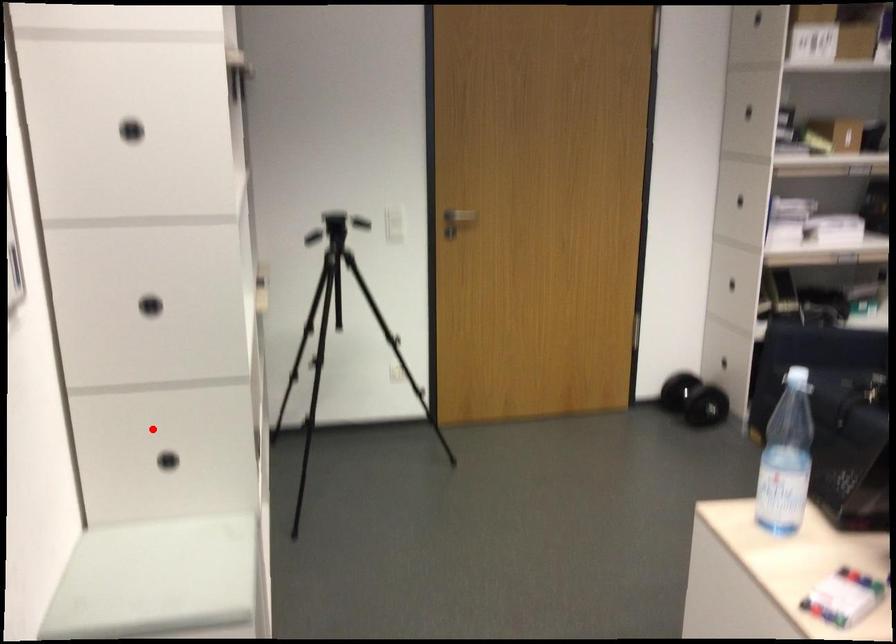
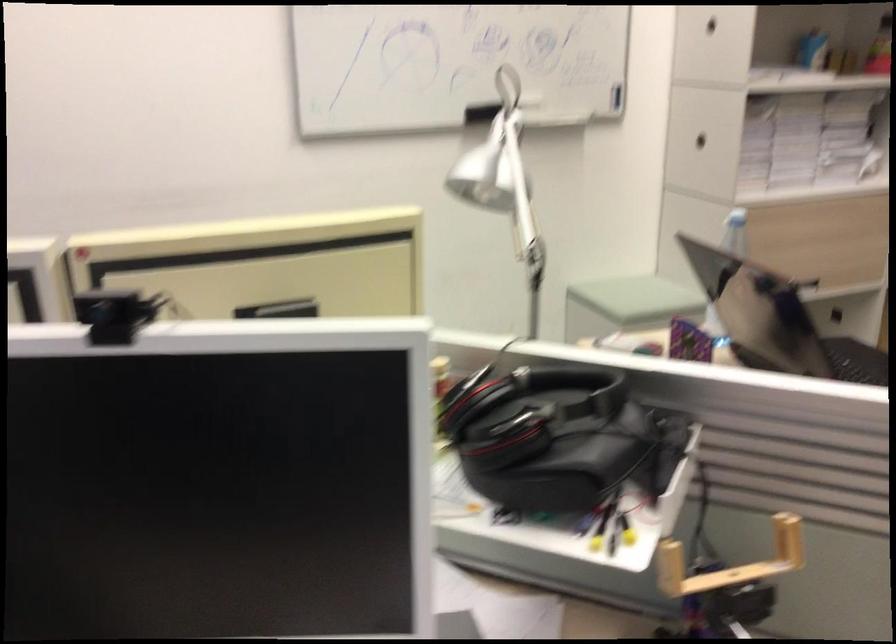
Question: I am providing you with two images of the same scene from different viewpoints. A red point is shown in image1. For the corresponding object point in image2, is it positioned nearer or farther from the camera?

Choices:
 (A) Nearer
 (B) Farther

Answer: (B)